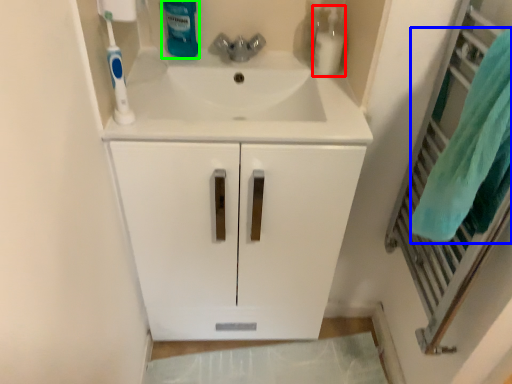
Question: Which object is positioned closest to cleaning product (highlighted by a red box)? Select from bath towel (highlighted by a blue box) and cleaning product (highlighted by a green box).

Choices:
 (A) bath towel
 (B) cleaning product

Answer: (B)